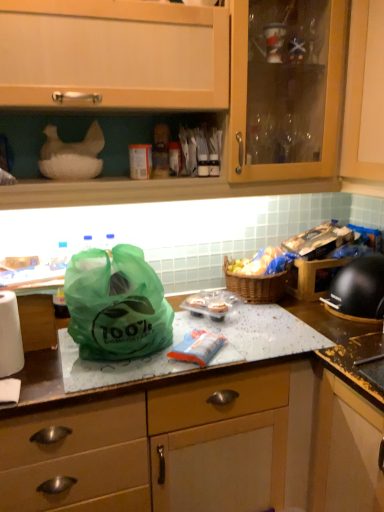
Identify the location of free space to the left of black plastic helmet at right. This screenshot has width=384, height=512. (301, 318).